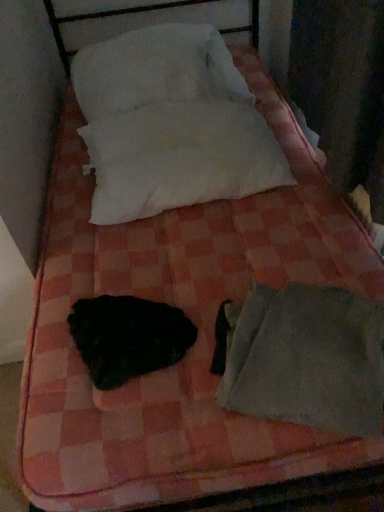
Question: Is white soft pillow at upper center, positioned as the second pillow in bottom-to-top order, oriented away from gray fabric sleeping bag at lower right?

Choices:
 (A) yes
 (B) no

Answer: (B)

Question: Does white soft pillow at upper center, positioned as the 1th pillow in top-to-bottom order, have a smaller size compared to gray fabric sleeping bag at lower right?

Choices:
 (A) no
 (B) yes

Answer: (A)

Question: Is white soft pillow at upper center, positioned as the second pillow in bottom-to-top order, at the left side of gray fabric sleeping bag at lower right?

Choices:
 (A) no
 (B) yes

Answer: (B)

Question: From the image's perspective, is white soft pillow at upper center, positioned as the second pillow in bottom-to-top order, over gray fabric sleeping bag at lower right?

Choices:
 (A) no
 (B) yes

Answer: (B)

Question: From a real-world perspective, is white soft pillow at upper center, positioned as the second pillow in bottom-to-top order, on gray fabric sleeping bag at lower right?

Choices:
 (A) yes
 (B) no

Answer: (A)

Question: Considering the relative sizes of white soft pillow at upper center, positioned as the second pillow in bottom-to-top order, and gray fabric sleeping bag at lower right in the image provided, is white soft pillow at upper center, positioned as the second pillow in bottom-to-top order, shorter than gray fabric sleeping bag at lower right?

Choices:
 (A) no
 (B) yes

Answer: (A)

Question: Can you confirm if gray fabric sleeping bag at lower right is shorter than white soft pillow at upper center, positioned as the 1th pillow in top-to-bottom order?

Choices:
 (A) yes
 (B) no

Answer: (A)

Question: Does gray fabric sleeping bag at lower right have a greater width compared to white soft pillow at upper center, positioned as the second pillow in bottom-to-top order?

Choices:
 (A) no
 (B) yes

Answer: (A)

Question: Is gray fabric sleeping bag at lower right beside white soft pillow at upper center, positioned as the 1th pillow in top-to-bottom order?

Choices:
 (A) yes
 (B) no

Answer: (B)

Question: Does gray fabric sleeping bag at lower right turn towards white soft pillow at upper center, positioned as the 1th pillow in top-to-bottom order?

Choices:
 (A) yes
 (B) no

Answer: (B)

Question: From a real-world perspective, is gray fabric sleeping bag at lower right located beneath white soft pillow at upper center, positioned as the second pillow in bottom-to-top order?

Choices:
 (A) no
 (B) yes

Answer: (B)

Question: Is gray fabric sleeping bag at lower right far away from white soft pillow at upper center, positioned as the 1th pillow in top-to-bottom order?

Choices:
 (A) no
 (B) yes

Answer: (A)

Question: Can you confirm if gray fabric sleeping bag at lower right is positioned to the right of black fuzzy animal at center?

Choices:
 (A) no
 (B) yes

Answer: (B)